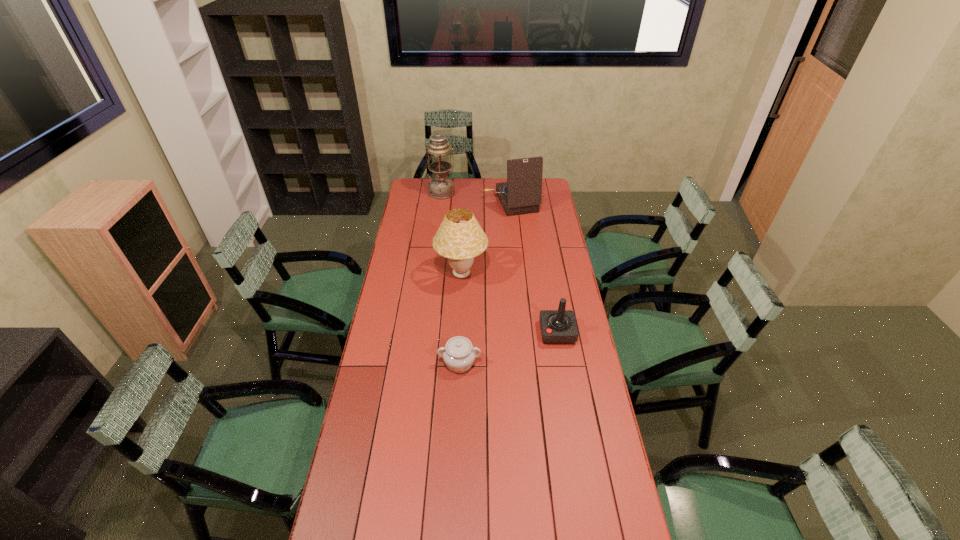
The height and width of the screenshot is (540, 960). Find the location of `vacant space that satisfies the following two spatial constraints: 1. on the front side of the oil lamp; 2. on the left side of the nearest object`. vacant space that satisfies the following two spatial constraints: 1. on the front side of the oil lamp; 2. on the left side of the nearest object is located at coordinates (421, 363).